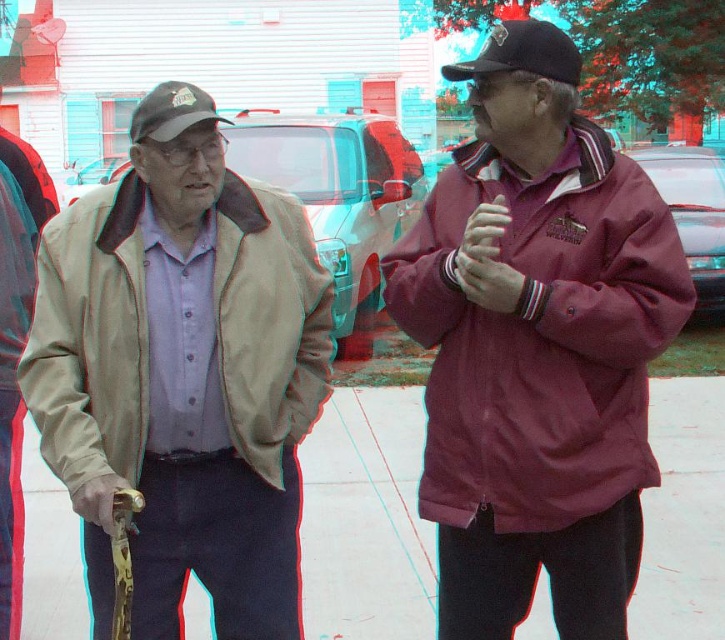
Is maroon fabric jacket at right above beige leather jacket at left?

Yes, maroon fabric jacket at right is above beige leather jacket at left.

Does maroon fabric jacket at right appear under beige leather jacket at left?

Actually, maroon fabric jacket at right is above beige leather jacket at left.

Which is behind, point (660, 218) or point (257, 364)?

Point (257, 364)

At what (x,y) coordinates should I click in order to perform the action: click on maroon fabric jacket at right. Please return your answer as a coordinate pair (x, y). Image resolution: width=725 pixels, height=640 pixels. Looking at the image, I should click on (542, 336).

Is white concrete pavement at center positioned in front of black matte baseball cap at upper right?

No, it is not.

Can you confirm if white concrete pavement at center is bigger than black matte baseball cap at upper right?

No, white concrete pavement at center is not bigger than black matte baseball cap at upper right.

Describe the element at coordinates (365, 518) in the screenshot. I see `white concrete pavement at center` at that location.

At what (x,y) coordinates should I click in order to perform the action: click on white concrete pavement at center. Please return your answer as a coordinate pair (x, y). This screenshot has width=725, height=640. Looking at the image, I should click on (365, 518).

Does maroon fabric jacket at right have a greater height compared to white concrete pavement at center?

Yes, maroon fabric jacket at right is taller than white concrete pavement at center.

Between maroon fabric jacket at right and white concrete pavement at center, which one is positioned higher?

Positioned higher is maroon fabric jacket at right.

At what (x,y) coordinates should I click in order to perform the action: click on maroon fabric jacket at right. Please return your answer as a coordinate pair (x, y). The image size is (725, 640). Looking at the image, I should click on (542, 336).

Where is `maroon fabric jacket at right`? The height and width of the screenshot is (640, 725). maroon fabric jacket at right is located at coordinates (542, 336).